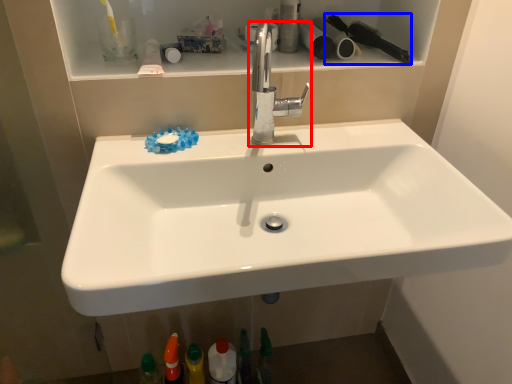
Question: Which point is further to the camera, tap (highlighted by a red box) or brush (highlighted by a blue box)?

Choices:
 (A) tap
 (B) brush

Answer: (B)